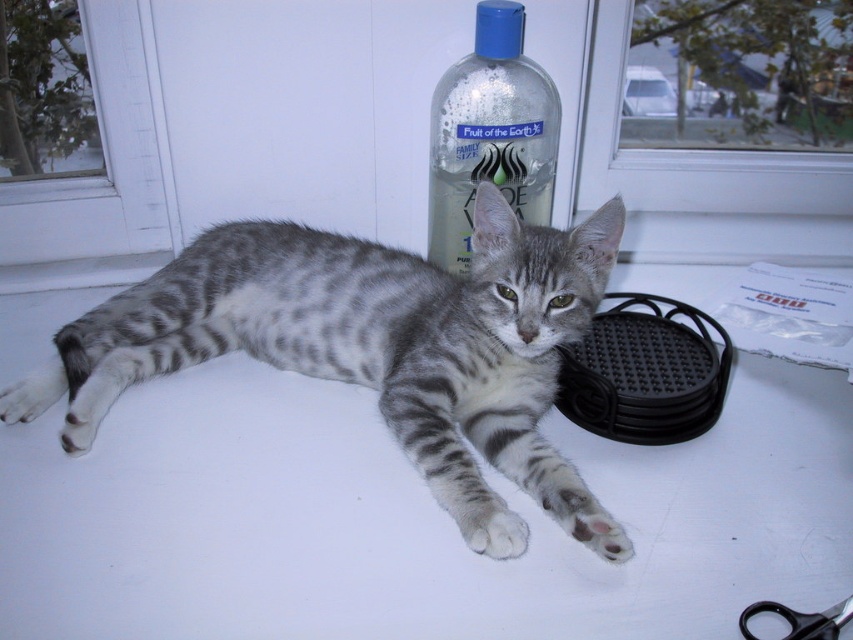
Does white plastic window at upper left appear on the right side of transparent glass window at upper center?

Incorrect, white plastic window at upper left is not on the right side of transparent glass window at upper center.

Is white plastic window at upper left bigger than transparent glass window at upper center?

Actually, white plastic window at upper left might be smaller than transparent glass window at upper center.

In order to click on white plastic window at upper left in this screenshot , I will do `click(103, 157)`.

This screenshot has height=640, width=853. Identify the location of gray striped fur at center. (373, 348).

The height and width of the screenshot is (640, 853). Describe the element at coordinates (373, 348) in the screenshot. I see `gray striped fur at center` at that location.

The width and height of the screenshot is (853, 640). I want to click on gray striped fur at center, so click(373, 348).

Does white plastic window at upper left have a lesser height compared to clear plastic bottle at upper center?

Yes.

Between point (44, 250) and point (508, 26), which one is positioned behind?

The point (44, 250) is behind.

Image resolution: width=853 pixels, height=640 pixels. In order to click on white plastic window at upper left in this screenshot , I will do `click(103, 157)`.